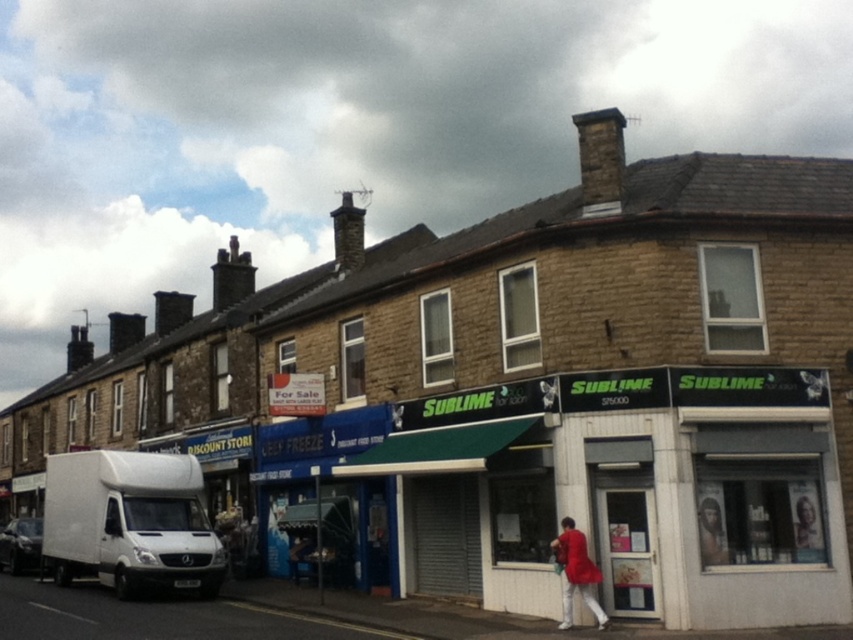
You are a pedestrian standing at the center of the street looking at the red fabric jacket at lower right and the white matte van at lower left. Which object is nearer to you?

The red fabric jacket at lower right is closer to the viewer than the white matte van at lower left.

You are a delivery person who needs to park your white matte truck at lower left near the smooth brown hair at center. Can you park the truck there without blocking the hair?

The white matte truck at lower left is positioned under smooth brown hair at center, so parking the truck there would block the hair.

You are standing at the point with coordinates point (129,522) in the image. What object is located at this point?

The point (129,522) corresponds to the white matte truck at lower left.